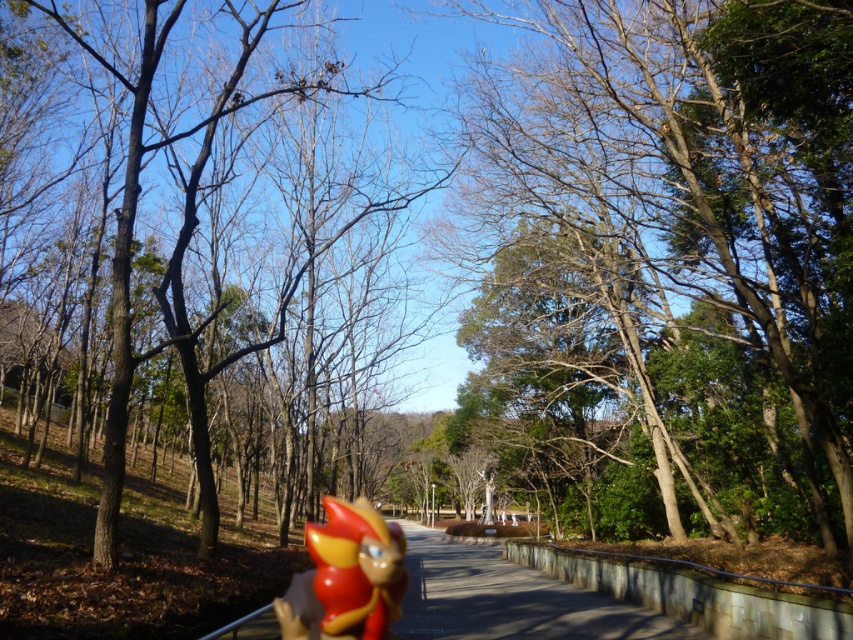
You are a park visitor wanting to walk between the smooth bark tree at center and the brown bark tree at center. Can you pass through the space between them comfortably?

The smooth bark tree at center is narrower than the brown bark tree at center, but the description only mentions their widths. Without knowing the distance between them, it is unclear if there is enough space to pass through comfortably.

You are standing at the point marked as point (666, 260) in the park. What object is located exactly at that point?

The smooth bark tree at center is located exactly at point (666, 260).

You are a park visitor who wants to place a small picnic blanket between the smooth bark tree at center and the glossy plastic toy at center. The picnic blanket is 2 meters long. Is there enough space between them to place the blanket without moving either object?

The smooth bark tree at center and glossy plastic toy at center are 7.80 meters apart from each other. Since the picnic blanket is only 2 meters long, there is more than enough space to place it between them without moving either object.